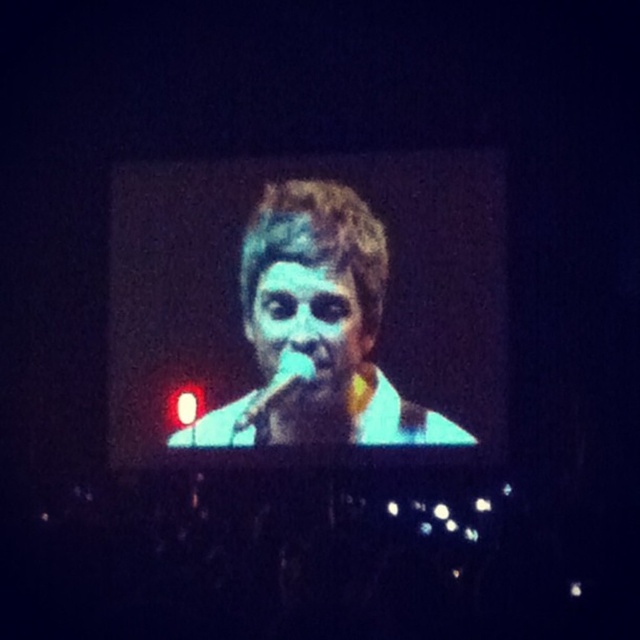
Between blue-tinted skin at center and blue matte face at center, which one has more height?

blue matte face at center is taller.

Is blue-tinted skin at center thinner than blue matte face at center?

Yes.

Is point (278, 404) positioned behind point (360, 326)?

Yes, point (278, 404) is farther from viewer.

I want to click on blue-tinted skin at center, so click(316, 330).